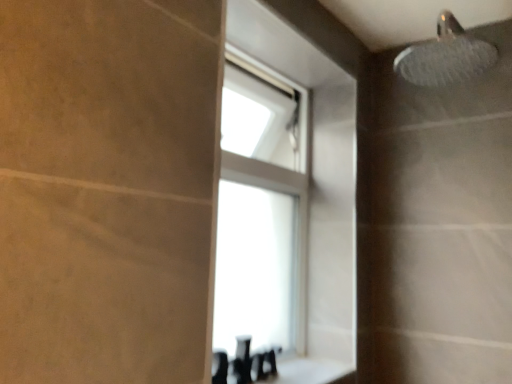
Question: Is white glossy counter top at lower center wider or thinner than transparent glass window at upper center?

Choices:
 (A) thin
 (B) wide

Answer: (B)

Question: Is white glossy counter top at lower center taller or shorter than transparent glass window at upper center?

Choices:
 (A) tall
 (B) short

Answer: (B)

Question: Is point click(311, 372) positioned closer to the camera than point click(325, 274)?

Choices:
 (A) farther
 (B) closer

Answer: (B)

Question: Which is correct: transparent glass window at upper center is inside white glossy counter top at lower center, or outside of it?

Choices:
 (A) inside
 (B) outside

Answer: (B)

Question: In the image, is transparent glass window at upper center positioned in front of or behind white glossy counter top at lower center?

Choices:
 (A) behind
 (B) front

Answer: (A)

Question: From a real-world perspective, relative to white glossy counter top at lower center, is transparent glass window at upper center vertically above or below?

Choices:
 (A) below
 (B) above

Answer: (B)

Question: In terms of height, does transparent glass window at upper center look taller or shorter compared to white glossy counter top at lower center?

Choices:
 (A) short
 (B) tall

Answer: (B)